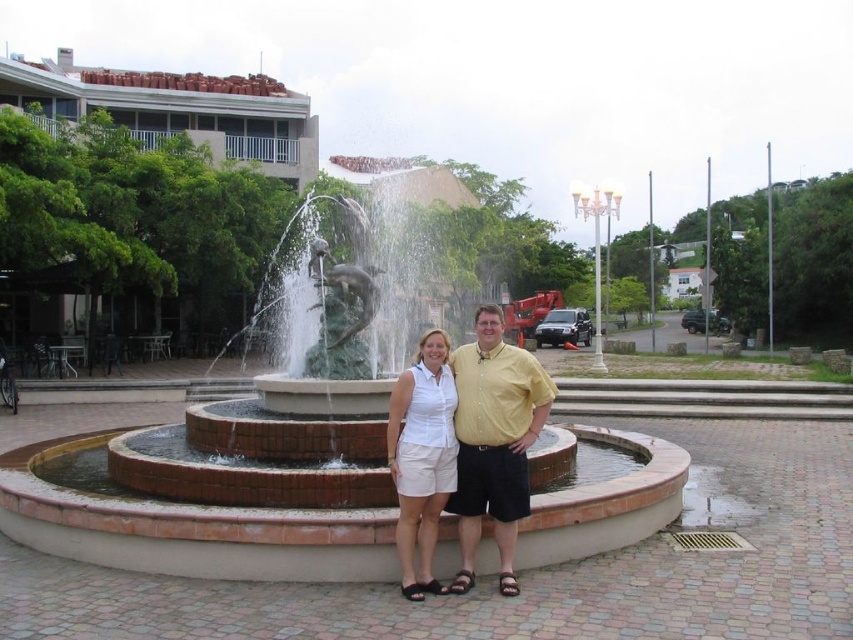
You are taking a photo of the brick fountain at center and the white cotton shorts at center. Which object is closer to the camera?

The brick fountain at center is closer to the camera than the white cotton shorts at center.

You are a photographer setting up for a group photo. You have to position a 2 meter wide backdrop behind the brick fountain at center and the white cotton shorts at center. Based on their sizes, will the backdrop be sufficient to cover both objects?

The brick fountain at center is wider than the white cotton shorts at center. Since the backdrop is 2 meters wide, it should be sufficient to cover both objects as long as they are positioned within the backdrop.

Consider the image. You are a photographer trying to capture the man in the scene. The man is wearing a yellow cotton shirt at center and white cotton shorts at center. Which clothing item is positioned higher on his body?

The yellow cotton shirt at center is above the white cotton shorts at center, so the yellow cotton shirt at center is positioned higher on his body.